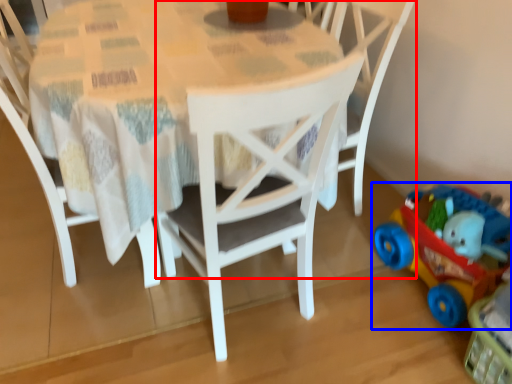
Question: Which object is further to the camera taking this photo, chair (highlighted by a red box) or toy (highlighted by a blue box)?

Choices:
 (A) chair
 (B) toy

Answer: (A)